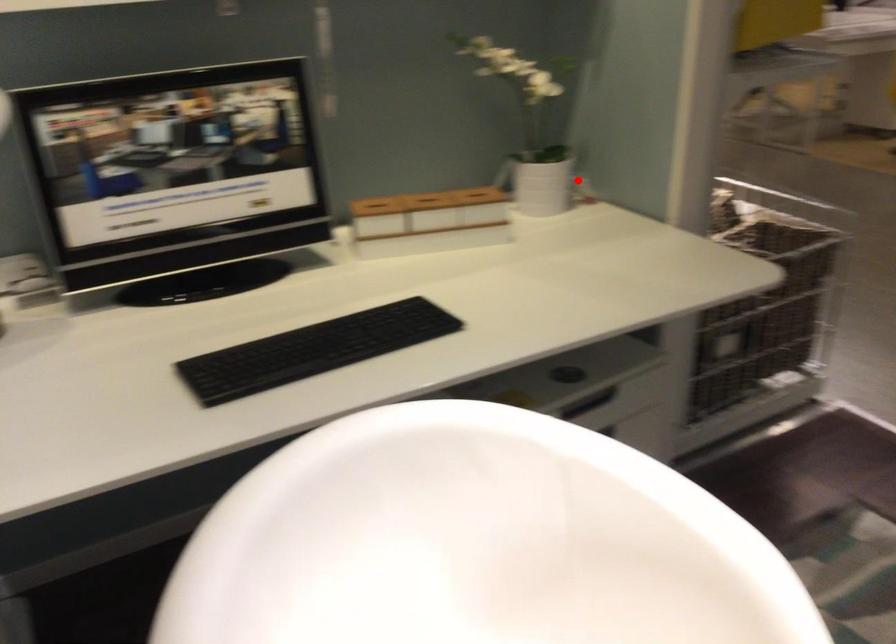
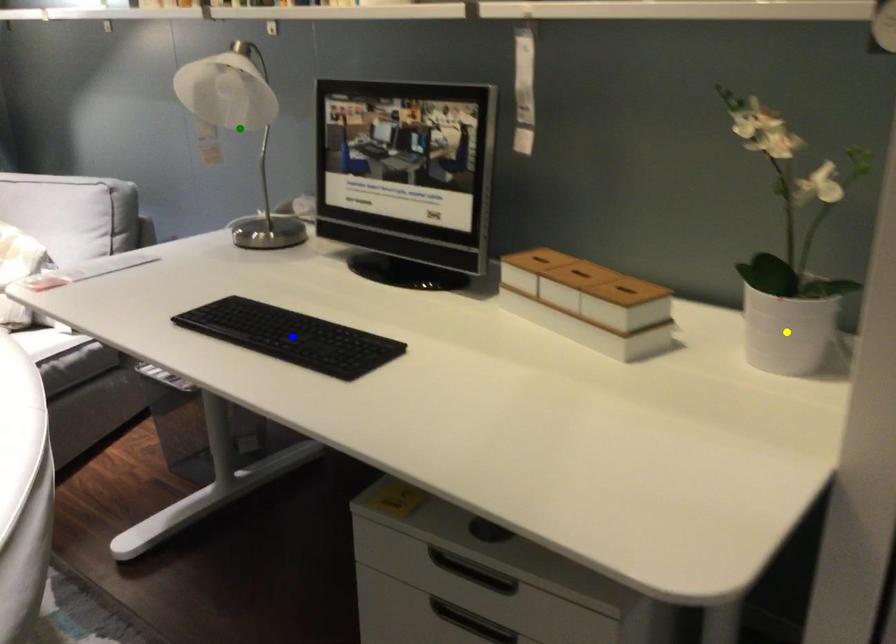
Question: I am providing you with two images of the same scene from different viewpoints. A red point is marked on the first image. You are given multiple points on the second image. Which mark in image 2 goes with the point in image 1?

Choices:
 (A) blue point
 (B) green point
 (C) yellow point

Answer: (C)